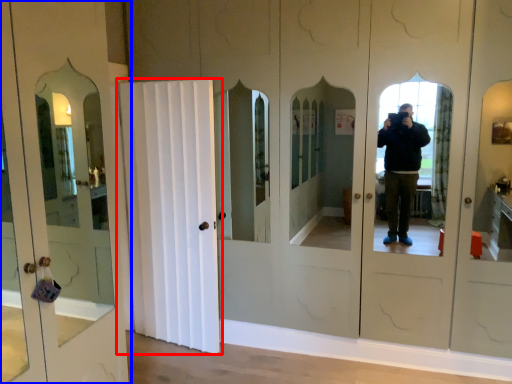
Question: Among these objects, which one is nearest to the camera, door (highlighted by a red box) or door (highlighted by a blue box)?

Choices:
 (A) door
 (B) door

Answer: (B)